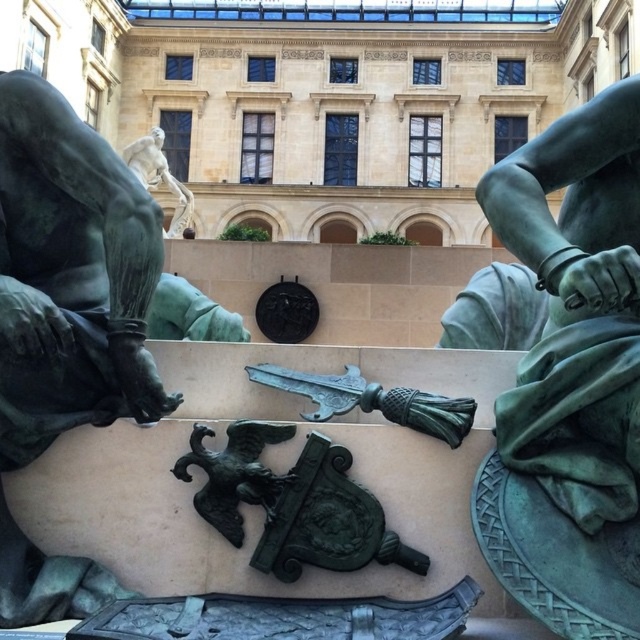
You are standing at the entrance of the museum and want to locate the bronze statue at left. According to the coordinates provided, where should you look relative to your current position?

The bronze statue at left is located at coordinates point (68, 276), which means it is positioned to the right and slightly below your current viewpoint.

You are a tour guide leading a group through this grand architectural setting. You want to ensure that your visitors can comfortably walk between the bronze statue at left and the bronze statue at upper center. Given that the average walking space required per person is 2 feet, how many people can comfortably walk side by side between these two statues?

The distance between the bronze statue at left and the bronze statue at upper center is 238.27 feet. Since the average walking space required per person is 2 feet, dividing the total distance by the space per person gives 238.27 divided by 2, which equals approximately 119.135. Therefore, approximately 119 people can comfortably walk side by side between these two statues.